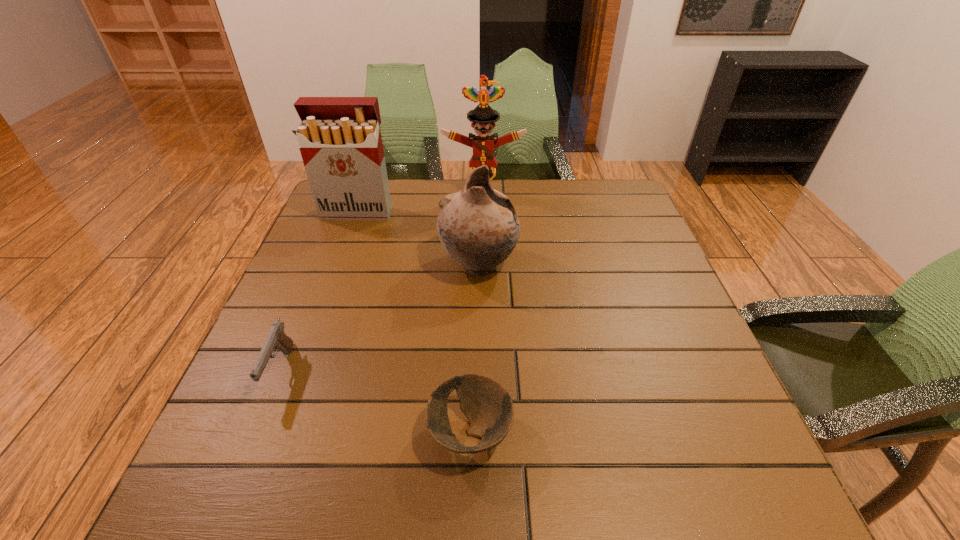
You are a GUI agent. You are given a task and a screenshot of the screen. Output one action in this format:
    pyautogui.click(x=<x>, y=<y>)
    Task: Click on the farthest object
    
    Given the screenshot: What is the action you would take?
    pyautogui.click(x=483, y=117)

At what (x,y) coordinates should I click in order to perform the action: click on the fourth nearest object. Please return your answer as a coordinate pair (x, y). The image size is (960, 540). Looking at the image, I should click on (340, 141).

I want to click on pottery, so click(x=478, y=227).

Locate an element on the screen. the third nearest object is located at coordinates (478, 227).

This screenshot has height=540, width=960. I want to click on the fourth tallest object, so click(x=277, y=339).

At what (x,y) coordinates should I click in order to perform the action: click on the shortest object. Please return your answer as a coordinate pair (x, y). The image size is (960, 540). Looking at the image, I should click on (488, 406).

The height and width of the screenshot is (540, 960). In order to click on vacant space located 0.260m on the front-facing side of the nutcracker in this screenshot , I will do `click(484, 257)`.

Find the location of a particular element. The width and height of the screenshot is (960, 540). vacant region located with the lid open on the second farthest object is located at coordinates (341, 257).

This screenshot has width=960, height=540. What are the coordinates of `free space located from the spout of the pottery` in the screenshot? It's located at (661, 265).

Image resolution: width=960 pixels, height=540 pixels. Identify the location of free space located at the barrel of the second shortest object. (230, 495).